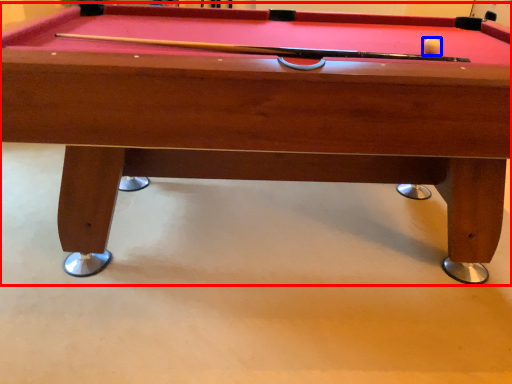
Question: Which object appears closest to the camera in this image, billiard table (highlighted by a red box) or ball (highlighted by a blue box)?

Choices:
 (A) billiard table
 (B) ball

Answer: (A)